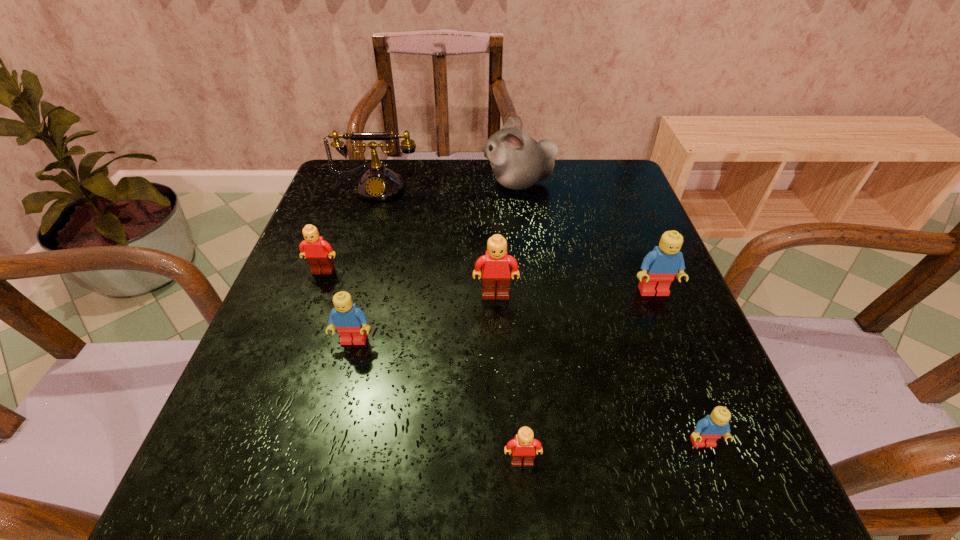
This screenshot has width=960, height=540. I want to click on object that is the nearest to the nearest object, so click(x=710, y=428).

Locate which object is the fourth closest to the telephone. Please provide its 2D coordinates. Your answer should be formatted as a tuple, i.e. [(x, y)], where the tuple contains the x and y coordinates of a point satisfying the conditions above.

[(350, 321)]

Select which Lego appears as the closest to the second smallest brown Lego. Please provide its 2D coordinates. Your answer should be formatted as a tuple, i.e. [(x, y)], where the tuple contains the x and y coordinates of a point satisfying the conditions above.

[(350, 321)]

Identify which Lego is the second nearest to the hamster. Please provide its 2D coordinates. Your answer should be formatted as a tuple, i.e. [(x, y)], where the tuple contains the x and y coordinates of a point satisfying the conditions above.

[(659, 267)]

Identify which blue Lego is located as the second nearest to the nearest Lego. Please provide its 2D coordinates. Your answer should be formatted as a tuple, i.e. [(x, y)], where the tuple contains the x and y coordinates of a point satisfying the conditions above.

[(350, 321)]

Find the location of a particular element. This screenshot has height=540, width=960. blue Lego that is the third closest to the farthest brown Lego is located at coordinates (710, 428).

Choose which brown Lego is the second nearest neighbor to the seventh farthest object. Please provide its 2D coordinates. Your answer should be formatted as a tuple, i.e. [(x, y)], where the tuple contains the x and y coordinates of a point satisfying the conditions above.

[(496, 260)]

Identify the location of brown Lego that can be found as the third closest to the black telephone. The height and width of the screenshot is (540, 960). (522, 447).

In order to click on vacant region that satisfies the following two spatial constraints: 1. on the face of the white hamster; 2. on the face of the second smallest brown Lego in this screenshot , I will do `click(529, 271)`.